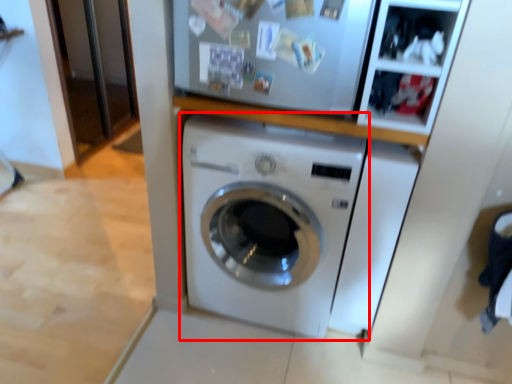
Question: From the image's perspective, what is the correct spatial positioning of washing machine (annotated by the red box) in reference to washing machine?

Choices:
 (A) below
 (B) above

Answer: (B)